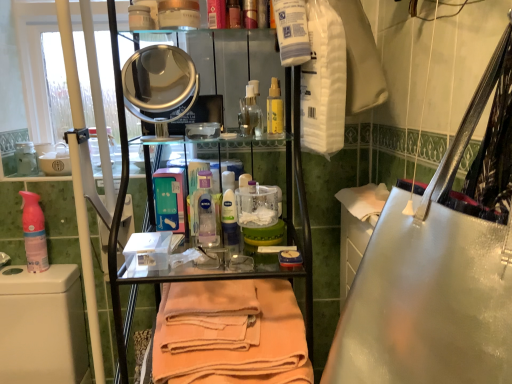
Question: Is translucent plastic bottle at center, arranged as the first cleaning product when viewed from the front, in front of white plastic toilet at lower left?

Choices:
 (A) no
 (B) yes

Answer: (A)

Question: Is translucent plastic bottle at center, arranged as the first cleaning product when viewed from the front, shorter than white plastic toilet at lower left?

Choices:
 (A) no
 (B) yes

Answer: (B)

Question: Is white plastic toilet at lower left at the back of translucent plastic bottle at center, the second cleaning product viewed from the back?

Choices:
 (A) yes
 (B) no

Answer: (B)

Question: Is translucent plastic bottle at center, the first cleaning product viewed from the right, aimed at white plastic toilet at lower left?

Choices:
 (A) yes
 (B) no

Answer: (B)

Question: From a real-world perspective, does translucent plastic bottle at center, the second cleaning product viewed from the back, sit lower than white plastic toilet at lower left?

Choices:
 (A) yes
 (B) no

Answer: (B)

Question: Considering the positions of translucent plastic bottle at center, the first cleaning product viewed from the right, and orange cotton towel at center in the image, is translucent plastic bottle at center, the first cleaning product viewed from the right, taller or shorter than orange cotton towel at center?

Choices:
 (A) short
 (B) tall

Answer: (A)

Question: Based on their positions, is translucent plastic bottle at center, arranged as the first cleaning product when viewed from the front, located to the left or right of orange cotton towel at center?

Choices:
 (A) left
 (B) right

Answer: (A)

Question: From a real-world perspective, relative to orange cotton towel at center, is translucent plastic bottle at center, which ranks as the 2th cleaning product in left-to-right order, vertically above or below?

Choices:
 (A) below
 (B) above

Answer: (B)

Question: Considering the positions of translucent plastic bottle at center, the first cleaning product viewed from the right, and orange cotton towel at center in the image, is translucent plastic bottle at center, the first cleaning product viewed from the right, bigger or smaller than orange cotton towel at center?

Choices:
 (A) small
 (B) big

Answer: (A)

Question: Is white plastic toilet at lower left in front of or behind translucent plastic bottle at center, the second cleaning product viewed from the back, in the image?

Choices:
 (A) front
 (B) behind

Answer: (A)

Question: Considering the positions of white plastic toilet at lower left and translucent plastic bottle at center, arranged as the first cleaning product when viewed from the front, in the image, is white plastic toilet at lower left wider or thinner than translucent plastic bottle at center, arranged as the first cleaning product when viewed from the front,?

Choices:
 (A) thin
 (B) wide

Answer: (B)

Question: Is point (50, 296) closer or farther from the camera than point (207, 226)?

Choices:
 (A) closer
 (B) farther

Answer: (B)

Question: From a real-world perspective, is white plastic toilet at lower left positioned above or below translucent plastic bottle at center, arranged as the first cleaning product when viewed from the front?

Choices:
 (A) below
 (B) above

Answer: (A)

Question: Considering their positions, is orange cotton towel at center located in front of or behind translucent plastic bottle at center, which ranks as the 2th cleaning product in left-to-right order?

Choices:
 (A) front
 (B) behind

Answer: (A)

Question: From the image's perspective, is orange cotton towel at center above or below translucent plastic bottle at center, arranged as the first cleaning product when viewed from the front?

Choices:
 (A) above
 (B) below

Answer: (B)